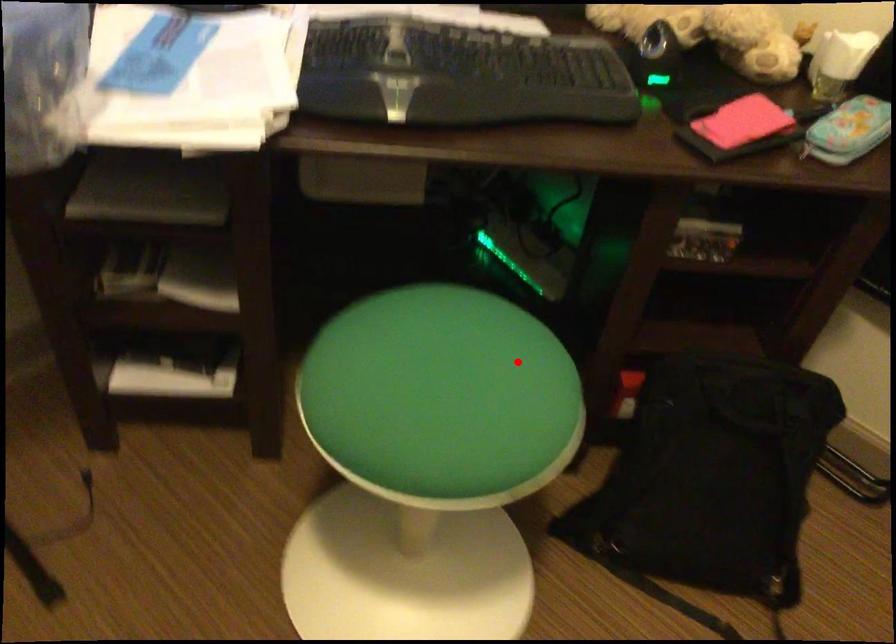
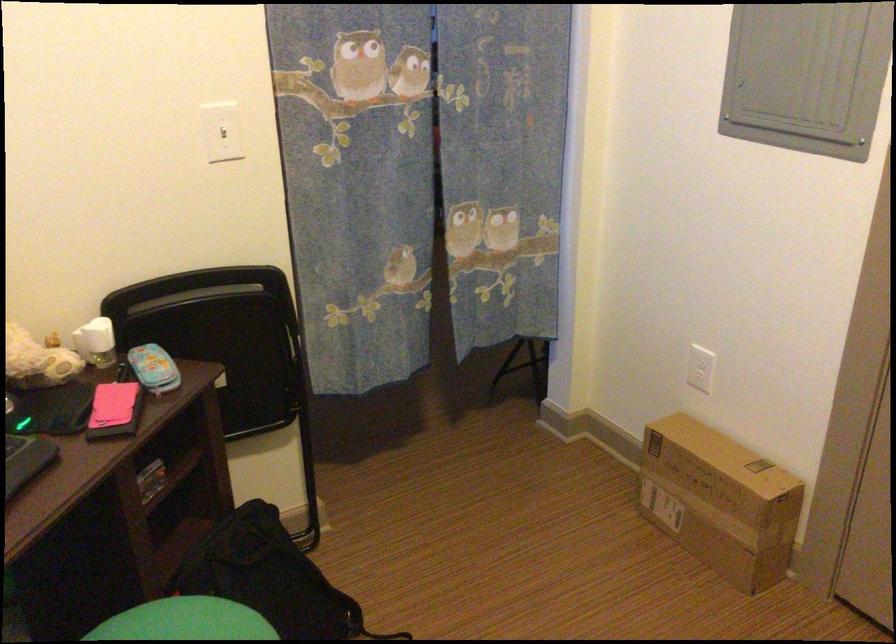
Question: I am providing you with two images of the same scene from different viewpoints. Given a red point in image1, look at the same physical point in image2. Is it:

Choices:
 (A) Closer to the viewpoint
 (B) Farther from the viewpoint

Answer: (B)